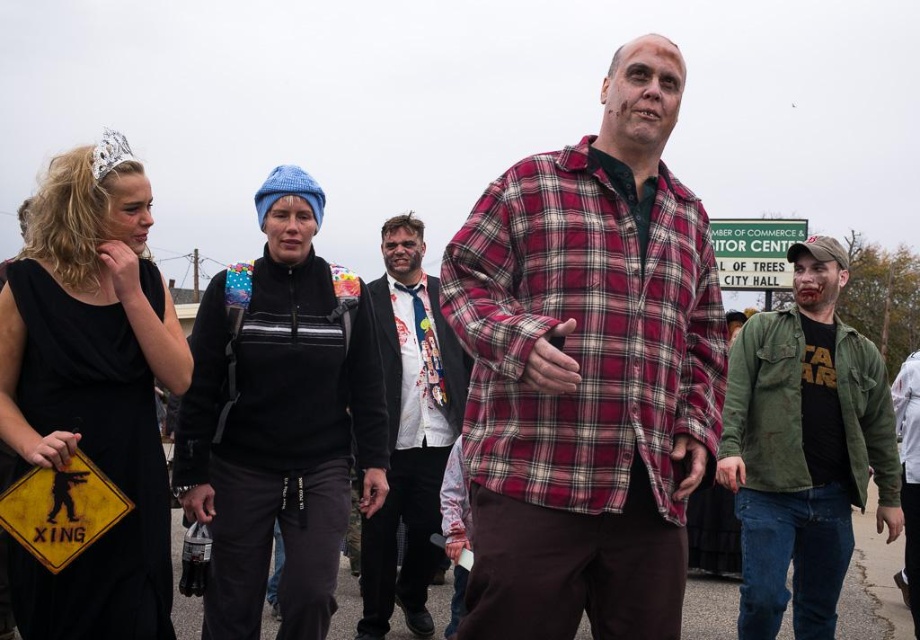
Question: Is the position of green textured jacket at right more distant than that of white printed shirt at center?

Choices:
 (A) yes
 (B) no

Answer: (A)

Question: Does black fleece jacket at center have a larger size compared to black satin dress at left?

Choices:
 (A) no
 (B) yes

Answer: (A)

Question: Considering the real-world distances, which object is farthest from the white printed shirt at center?

Choices:
 (A) black fleece jacket at center
 (B) white shirt with tie at center
 (C) green textured jacket at right
 (D) plaid flannel shirt at center

Answer: (C)

Question: Does white printed shirt at center have a smaller size compared to green plastic sign at upper center?

Choices:
 (A) no
 (B) yes

Answer: (A)

Question: Which point is farther from the camera taking this photo?

Choices:
 (A) (848, 435)
 (B) (738, 228)
 (C) (536, 470)

Answer: (B)

Question: Which of the following is the closest to the observer?

Choices:
 (A) green plastic sign at upper center
 (B) black satin dress at left
 (C) black fleece jacket at center
 (D) white printed shirt at center

Answer: (B)